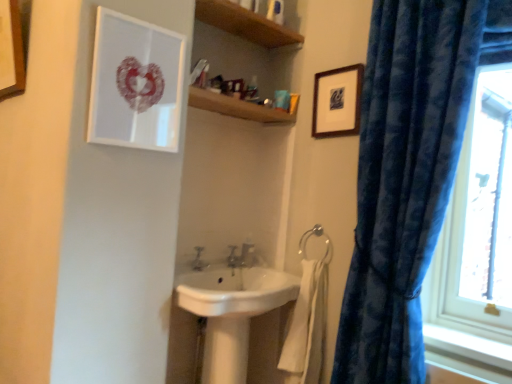
Image resolution: width=512 pixels, height=384 pixels. What do you see at coordinates (408, 172) in the screenshot? I see `velvety blue curtain at right` at bounding box center [408, 172].

The image size is (512, 384). Describe the element at coordinates (12, 47) in the screenshot. I see `wooden picture frame at upper left, acting as the 1th picture frame starting from the left` at that location.

In order to face wooden picture frame at upper left, acting as the 1th picture frame starting from the left, should I rotate leftwards or rightwards?

A 30.844 degree turn to the left will do.

At what (x,y) coordinates should I click in order to perform the action: click on white ceramic sink at center, which appears as the 2th plumbing fixture when viewed from the right. Please return your answer as a coordinate pair (x, y). Looking at the image, I should click on (232, 257).

The height and width of the screenshot is (384, 512). I want to click on velvety blue curtain at right, so 408,172.

Which of these two, silver metallic towel bar at center or white glossy pillar at center, stands shorter?

With less height is silver metallic towel bar at center.

Considering the sizes of objects silver metallic towel bar at center and white glossy pillar at center in the image provided, who is wider, silver metallic towel bar at center or white glossy pillar at center?

white glossy pillar at center is wider.

The image size is (512, 384). What are the coordinates of `towel bar on the right of the white glossy pillar at center` in the screenshot? It's located at (316, 236).

Is silver metallic towel bar at center positioned in front of white glossy pillar at center?

No, silver metallic towel bar at center is further to the viewer.

Based on the photo, is white ceramic sink at center, which appears as the 2th plumbing fixture when viewed from the right, far away from white glossy sink at center?

No, white ceramic sink at center, which appears as the 2th plumbing fixture when viewed from the right, is not far from white glossy sink at center.

Considering the relative sizes of white ceramic sink at center, which appears as the 2th plumbing fixture when viewed from the right, and white glossy sink at center in the image provided, is white ceramic sink at center, which appears as the 2th plumbing fixture when viewed from the right, taller than white glossy sink at center?

No, white ceramic sink at center, which appears as the 2th plumbing fixture when viewed from the right, is not taller than white glossy sink at center.

Does white ceramic sink at center, which appears as the 2th plumbing fixture when viewed from the right, contain white glossy sink at center?

No, white glossy sink at center is not a part of white ceramic sink at center, which appears as the 2th plumbing fixture when viewed from the right.

Is white ceramic sink at center, which appears as the 2th plumbing fixture when viewed from the right, further to the viewer compared to white glossy sink at center?

Yes, it is.

Is matte white picture frame at upper left, which is counted as the 2th picture frame, starting from the right, bigger or smaller than transparent glass window at right?

Clearly, matte white picture frame at upper left, which is counted as the 2th picture frame, starting from the right, is smaller in size than transparent glass window at right.

Does point (174, 33) come farther from viewer compared to point (486, 239)?

That is False.

Which object is more forward, matte white picture frame at upper left, which is counted as the 2th picture frame, starting from the right, or transparent glass window at right?

Positioned in front is matte white picture frame at upper left, which is counted as the 2th picture frame, starting from the right.

From the image's perspective, between matte white picture frame at upper left, which is counted as the second picture frame, starting from the left, and transparent glass window at right, who is located below?

transparent glass window at right is shown below in the image.

Would you say velvety blue curtain at right is inside or outside white glossy pillar at center?

velvety blue curtain at right is not inside white glossy pillar at center, it's outside.

Is the position of velvety blue curtain at right less distant than that of white glossy pillar at center?

Yes, velvety blue curtain at right is closer to the viewer.

At what (x,y) coordinates should I click in order to perform the action: click on pillar that appears on the left of velvety blue curtain at right. Please return your answer as a coordinate pair (x, y). Looking at the image, I should click on (226, 350).

Does velvety blue curtain at right have a lesser width compared to white glossy pillar at center?

No, velvety blue curtain at right is not thinner than white glossy pillar at center.

Is wooden shelf at upper center looking in the opposite direction of white ceramic faucet at center, which is the 2th plumbing fixture in left-to-right order?

No, wooden shelf at upper center's orientation is not away from white ceramic faucet at center, which is the 2th plumbing fixture in left-to-right order.

How distant is wooden shelf at upper center from white ceramic faucet at center, the 1th plumbing fixture in the right-to-left sequence?

wooden shelf at upper center and white ceramic faucet at center, the 1th plumbing fixture in the right-to-left sequence, are 3.41 feet apart from each other.

Can you confirm if wooden shelf at upper center is wider than white ceramic faucet at center, the 1th plumbing fixture in the right-to-left sequence?

Indeed, wooden shelf at upper center has a greater width compared to white ceramic faucet at center, the 1th plumbing fixture in the right-to-left sequence.

The height and width of the screenshot is (384, 512). There is a wooden shelf at upper center. Find the location of `the 1st plumbing fixture below it (from the image's perspective)`. the 1st plumbing fixture below it (from the image's perspective) is located at coordinates (247, 255).

Would you say wooden picture frame at upper right, which appears as the 1th picture frame when viewed from the right, is inside or outside white cotton bath towel at lower center?

wooden picture frame at upper right, which appears as the 1th picture frame when viewed from the right, lies outside white cotton bath towel at lower center.

From the image's perspective, which one is positioned lower, wooden picture frame at upper right, which appears as the 1th picture frame when viewed from the right, or white cotton bath towel at lower center?

white cotton bath towel at lower center, from the image's perspective.

Which is in front, wooden picture frame at upper right, the third picture frame when ordered from left to right, or white cotton bath towel at lower center?

white cotton bath towel at lower center is in front.

Where is `picture frame that is behind the white cotton bath towel at lower center`? The height and width of the screenshot is (384, 512). picture frame that is behind the white cotton bath towel at lower center is located at coordinates (337, 102).

Based on their positions, is white cotton bath towel at lower center located to the left or right of wooden picture frame at upper right, which appears as the 1th picture frame when viewed from the right?

white cotton bath towel at lower center is to the left of wooden picture frame at upper right, which appears as the 1th picture frame when viewed from the right.

Based on the photo, from a real-world perspective, between white cotton bath towel at lower center and wooden picture frame at upper right, which appears as the 1th picture frame when viewed from the right, who is vertically lower?

white cotton bath towel at lower center, from a real-world perspective.

Is white cotton bath towel at lower center not near wooden picture frame at upper right, the third picture frame when ordered from left to right?

Actually, white cotton bath towel at lower center and wooden picture frame at upper right, the third picture frame when ordered from left to right, are a little close together.

From the image's perspective, is white cotton bath towel at lower center located beneath wooden picture frame at upper right, the third picture frame when ordered from left to right?

Yes.

Where is `pillar on the left of silver metallic towel bar at center`? The width and height of the screenshot is (512, 384). pillar on the left of silver metallic towel bar at center is located at coordinates (226, 350).

Identify the location of the 1st plumbing fixture behind the white glossy sink at center, counting from the anchor's position. click(x=232, y=257).

Looking at the image, which one is located closer to transparent glass window at right, wooden picture frame at upper right, the third picture frame when ordered from left to right, or matte silver tap at center?

wooden picture frame at upper right, the third picture frame when ordered from left to right.

In the scene shown: Looking at the image, which one is located further to wooden picture frame at upper left, acting as the 1th picture frame starting from the left, matte silver tap at center or matte white picture frame at upper left, which is counted as the second picture frame, starting from the left?

matte silver tap at center is further to wooden picture frame at upper left, acting as the 1th picture frame starting from the left.

Considering their positions, is white glossy pillar at center positioned closer to white cotton bath towel at lower center than wooden shelf at upper center?

The object closer to white cotton bath towel at lower center is white glossy pillar at center.

Estimate the real-world distances between objects in this image. Which object is further from white cotton bath towel at lower center, white plastic tube at upper center or wooden shelf at upper center?

white plastic tube at upper center lies further to white cotton bath towel at lower center than the other object.

When comparing their distances from transparent glass window at right, does wooden shelf at upper center or wooden picture frame at upper right, which appears as the 1th picture frame when viewed from the right, seem further?

wooden shelf at upper center lies further to transparent glass window at right than the other object.

Based on their spatial positions, is matte white picture frame at upper left, which is counted as the 2th picture frame, starting from the right, or white glossy pillar at center closer to wooden shelf at upper center?

The object closer to wooden shelf at upper center is matte white picture frame at upper left, which is counted as the 2th picture frame, starting from the right.

Based on their spatial positions, is transparent glass window at right or white glossy pillar at center closer to wooden shelf at upper center?

Based on the image, transparent glass window at right appears to be nearer to wooden shelf at upper center.

Considering their positions, is wooden picture frame at upper left, acting as the 1th picture frame starting from the left, positioned closer to white ceramic faucet at center, which is the 2th plumbing fixture in left-to-right order, than silver metallic towel bar at center?

silver metallic towel bar at center.

Where is `window between white plastic tube at upper center and white ceramic sink at center, which is counted as the first plumbing fixture, starting from the left, from top to bottom`? This screenshot has width=512, height=384. window between white plastic tube at upper center and white ceramic sink at center, which is counted as the first plumbing fixture, starting from the left, from top to bottom is located at coordinates (479, 218).

The image size is (512, 384). I want to click on tap between white glossy sink at center and white ceramic faucet at center, the 1th plumbing fixture in the right-to-left sequence, from front to back, so point(199,260).

Where is `bookshelf between wooden picture frame at upper left, acting as the 1th picture frame starting from the left, and white plastic tube at upper center, in the horizontal direction`? bookshelf between wooden picture frame at upper left, acting as the 1th picture frame starting from the left, and white plastic tube at upper center, in the horizontal direction is located at coordinates (245, 24).

This screenshot has height=384, width=512. In order to click on curtain between white plastic tube at upper center and white ceramic faucet at center, the 1th plumbing fixture in the right-to-left sequence, vertically in this screenshot , I will do `click(408, 172)`.